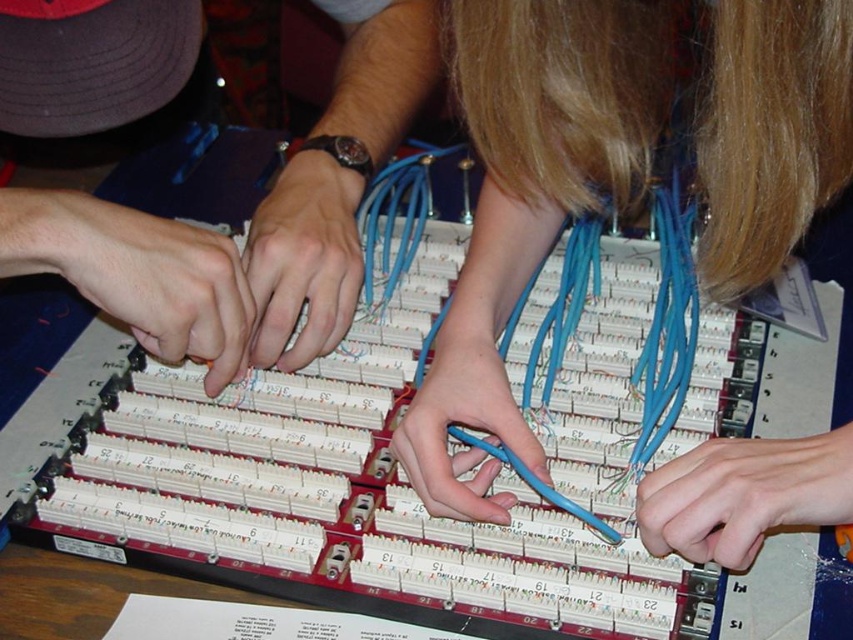
Question: Does matte black hands at center appear on the right side of matte black hand at center?

Choices:
 (A) yes
 (B) no

Answer: (B)

Question: Which of these objects is positioned closest to the matte black hand at left?

Choices:
 (A) blue rubber band at center
 (B) matte black hand at center
 (C) blue plastic hand at lower right

Answer: (B)

Question: Considering the relative positions of blue plastic hand at lower right and matte black hand at center in the image provided, where is blue plastic hand at lower right located with respect to matte black hand at center?

Choices:
 (A) right
 (B) left

Answer: (A)

Question: Can you confirm if blue rubber gloves at center is bigger than matte black hands at center?

Choices:
 (A) yes
 (B) no

Answer: (A)

Question: Which of the following is the farthest from the observer?

Choices:
 (A) matte black hands at center
 (B) blue rubber band at center
 (C) matte black hand at center

Answer: (C)

Question: Which point appears closest to the camera in this image?

Choices:
 (A) (729, 531)
 (B) (822, 204)
 (C) (161, 326)
 (D) (437, 410)

Answer: (A)